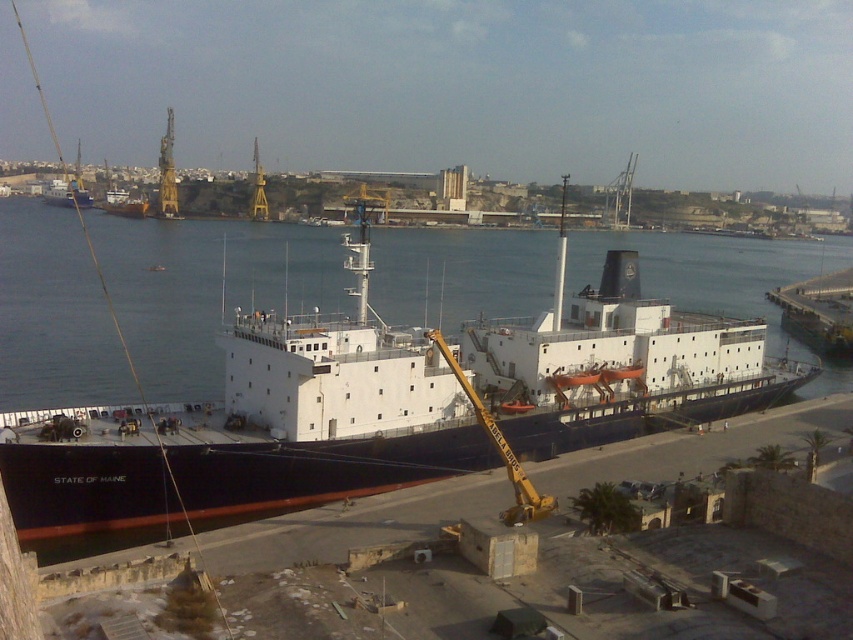
You are a port manager assessing the dock space. You need to determine which ship, the black matte ship at center or the matte black ship at upper left, requires more space for maneuvering. Based on their sizes, which one would need a wider berth?

The black matte ship at center requires a wider berth because its width is larger than that of the matte black ship at upper left.

You are standing on the dock and see the point marked at coordinates [383,408]. What does this point indicate?

The point at coordinates [383,408] marks the location of the black matte ship at center.

You are standing on the dock and looking at the ship. There are two points marked on the ship. One is at coordinate point (106, 426) and the other is at point (71, 200). Which point is closer to you?

Point (106, 426) is closer to the camera than point (71, 200).